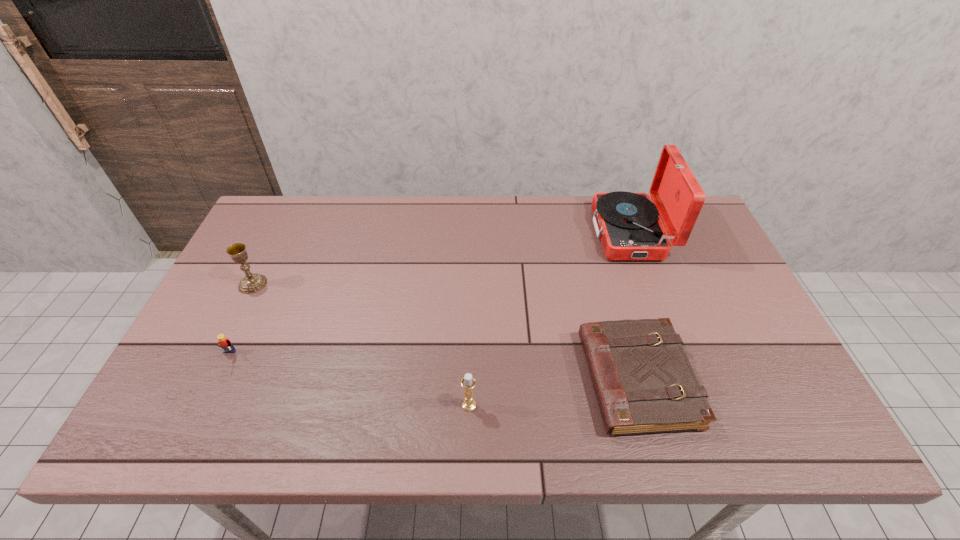
You are a GUI agent. You are given a task and a screenshot of the screen. Output one action in this format:
    pyautogui.click(x=<x>, y=<y>)
    Task: Click on the free location at the far edge
    The image size is (960, 540).
    Given the screenshot: What is the action you would take?
    pyautogui.click(x=503, y=212)

The image size is (960, 540). In order to click on free space at the near edge in this screenshot , I will do `click(693, 445)`.

Locate an element on the screen. vacant space at the left edge is located at coordinates (215, 386).

The width and height of the screenshot is (960, 540). In the image, there is a desktop. Find the location of `vacant space at the right edge`. vacant space at the right edge is located at coordinates (717, 256).

Find the location of a particular element. free space at the far left corner of the desktop is located at coordinates (281, 201).

This screenshot has height=540, width=960. What are the coordinates of `free space at the near left corner of the desktop` in the screenshot? It's located at (202, 435).

Image resolution: width=960 pixels, height=540 pixels. I want to click on free space between the hardback book and the second farthest object, so click(x=445, y=332).

The width and height of the screenshot is (960, 540). In order to click on unoccupied position between the fourth nearest object and the hardback book in this screenshot , I will do `click(445, 332)`.

The height and width of the screenshot is (540, 960). What are the coordinates of `free space between the candle holder and the fourth tallest object` in the screenshot? It's located at (348, 381).

This screenshot has height=540, width=960. In order to click on free spot between the farthest object and the fourth nearest object in this screenshot , I will do `click(442, 258)`.